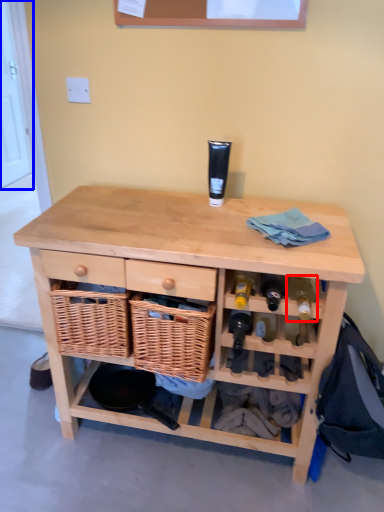
Question: Which of the following is the closest to the observer, wine bottle (highlighted by a red box) or door (highlighted by a blue box)?

Choices:
 (A) wine bottle
 (B) door

Answer: (A)